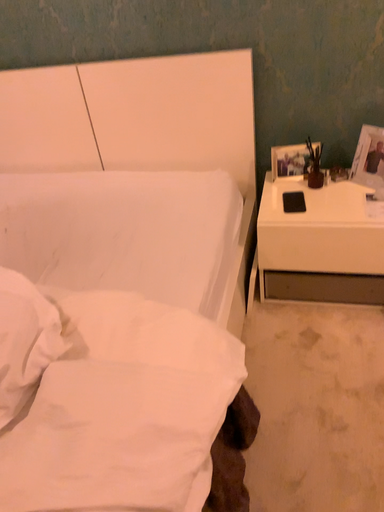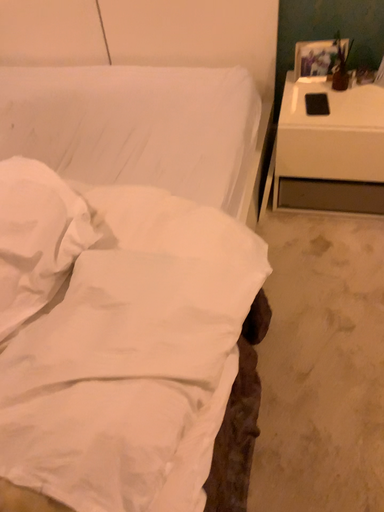
Question: Which way did the camera rotate in the video?

Choices:
 (A) rotated upward
 (B) rotated downward

Answer: (B)